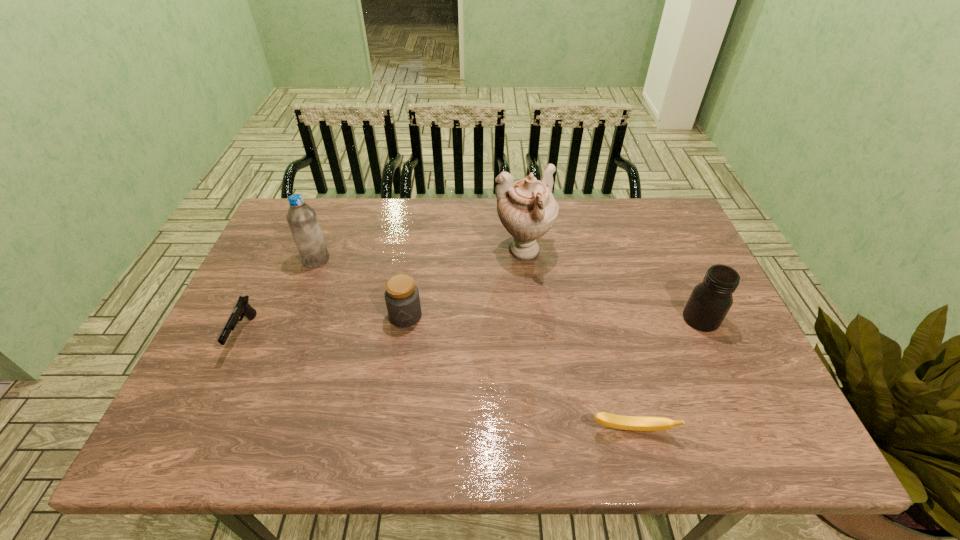
The width and height of the screenshot is (960, 540). I want to click on the shortest object, so click(633, 423).

The width and height of the screenshot is (960, 540). What are the coordinates of `the second object from right to left` in the screenshot? It's located at (633, 423).

The width and height of the screenshot is (960, 540). Find the location of `vacant area situated 0.080m on the right of the urn`. vacant area situated 0.080m on the right of the urn is located at coordinates (579, 252).

The image size is (960, 540). What are the coordinates of `vacant space located on the right of the second tallest object` in the screenshot? It's located at (373, 259).

I want to click on free space located on the left of the taller jar, so click(x=578, y=319).

The height and width of the screenshot is (540, 960). Find the location of `vacant space located on the surface of the shorter jar near the warning symbol`. vacant space located on the surface of the shorter jar near the warning symbol is located at coordinates (395, 388).

Identify the location of vacant space situated 0.220m at the aiming end of the gun. (189, 450).

Locate an element on the screen. object at the far edge is located at coordinates (527, 209).

Find the location of `object positioned at the near edge`. object positioned at the near edge is located at coordinates (633, 423).

The image size is (960, 540). I want to click on water bottle situated at the left edge, so click(302, 220).